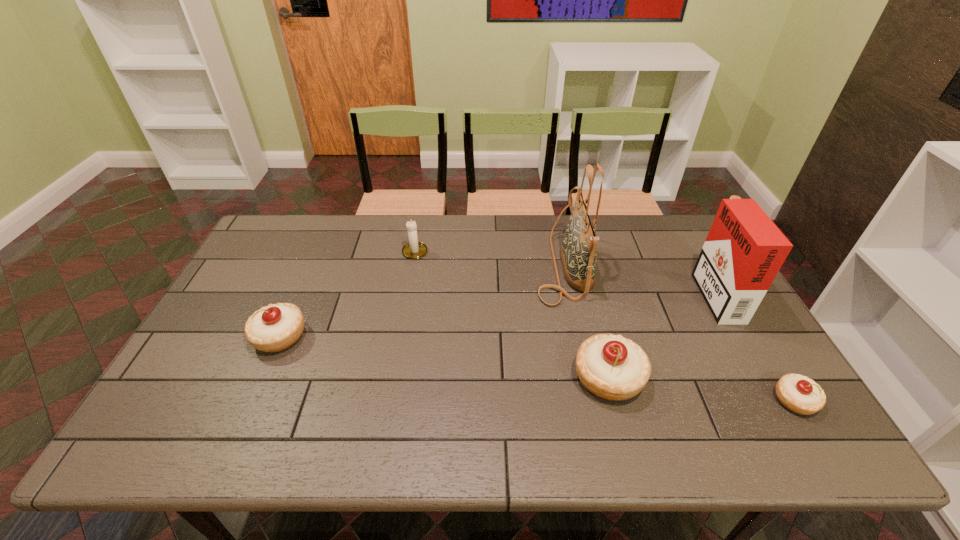
Find the location of `vacant spot for a new pastry to ensure equal spacing`. vacant spot for a new pastry to ensure equal spacing is located at coordinates (437, 356).